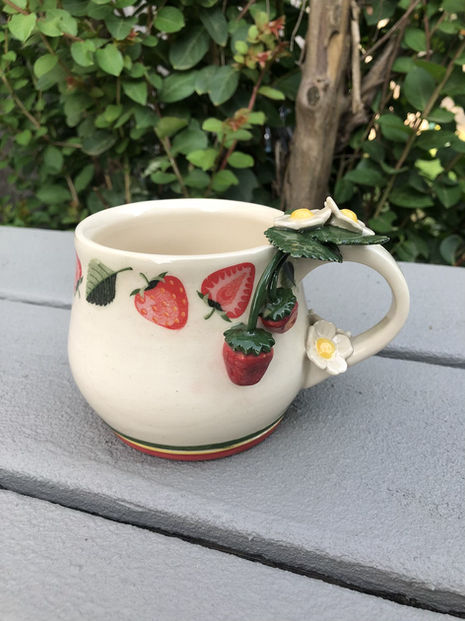
Image resolution: width=465 pixels, height=621 pixels. I want to click on pot, so click(x=242, y=372).